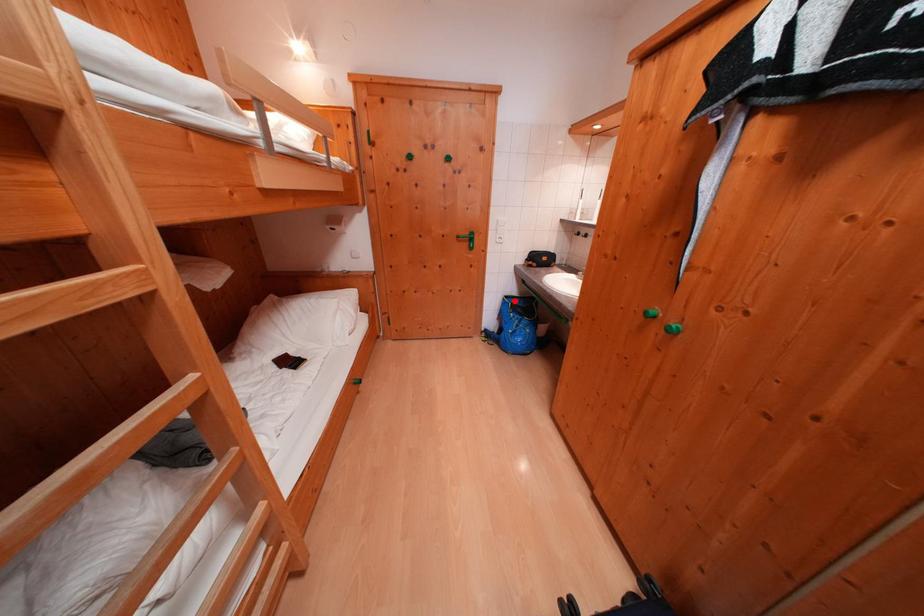
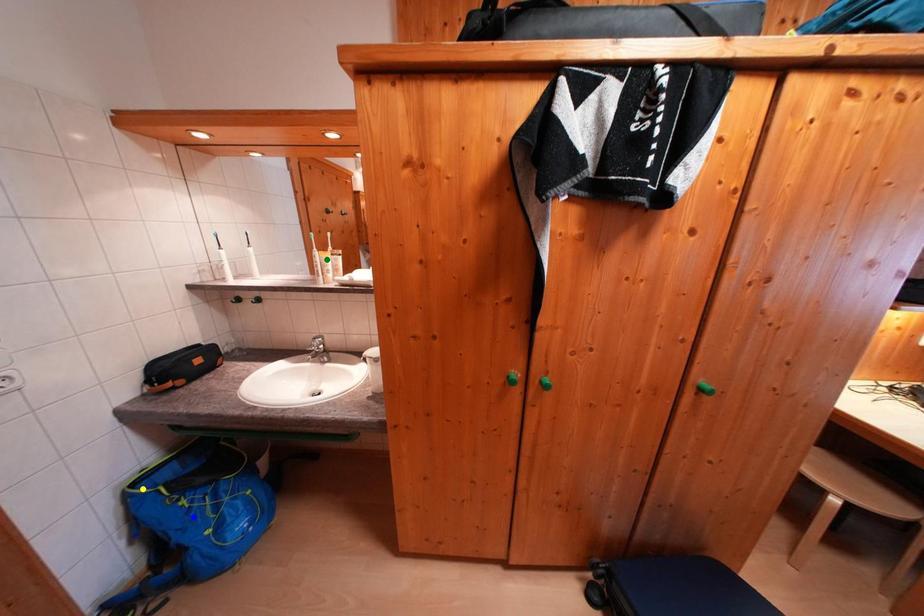
Question: I am providing you with two images of the same scene from different viewpoints. A red point is marked on the first image. You are given multiple points on the second image. Which point in image 2 is actually the same real-world point as the red point in image 1?

Choices:
 (A) green point
 (B) blue point
 (C) yellow point

Answer: (C)